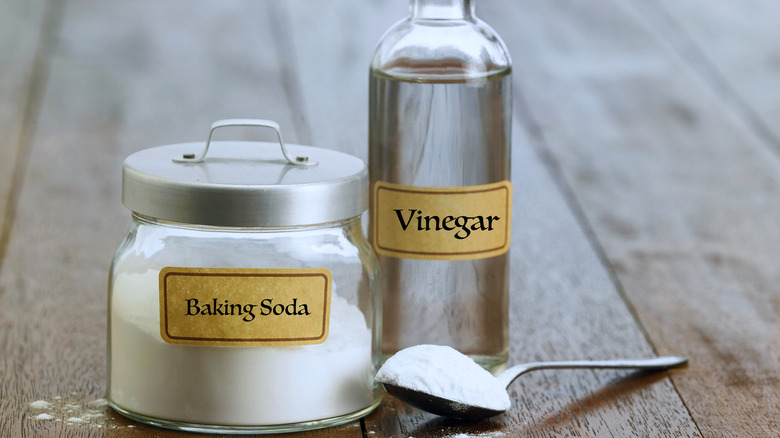
Where is `spoon handle`? spoon handle is located at coordinates (651, 363).